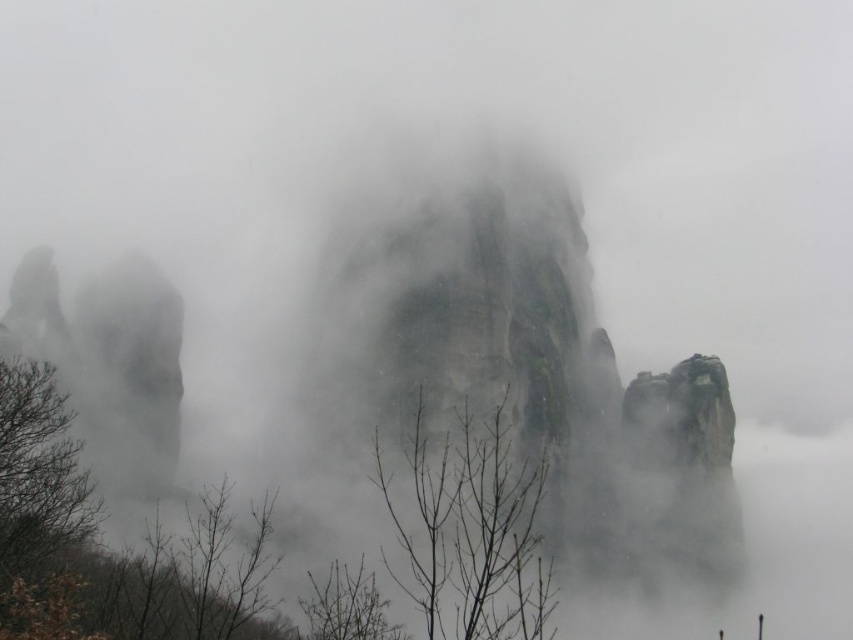
You are an environmental scientist analyzing the landscape. You need to determine which object has a greater width between the brown bare branches at center and the brown leafless tree at lower center. Based on the scene, which one is wider?

The brown bare branches at center is wider than the brown leafless tree at lower center.

You are a hiker who wants to take a photo of both the brown leafy tree at lower left and the brown leafless branches at lower left. Which object should you focus on first to ensure both are in the frame?

The brown leafy tree at lower left is much taller than the brown leafless branches at lower left. To include both in the frame, focus on the brown leafy tree at lower left first since it occupies more vertical space.

You are a hiker trying to navigate through the misty landscape. You see the brown bare branches at center and the brown leafless tree at lower center. Which one is closer to the ground?

The brown leafless tree at lower center is closer to the ground because it is positioned lower than the brown bare branches at center.